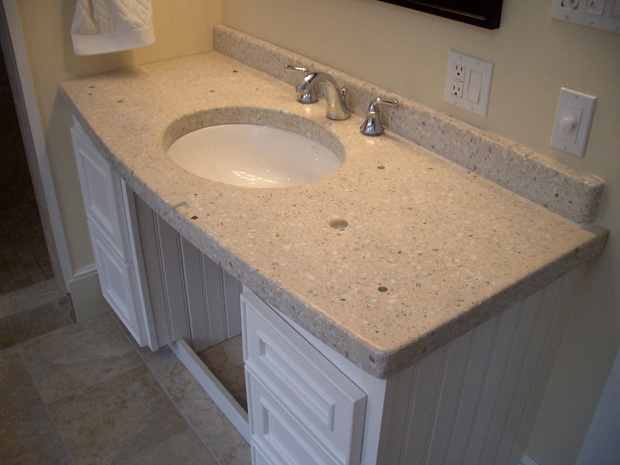
Identify the location of backsplash left of sink. The width and height of the screenshot is (620, 465). coord(260,59).